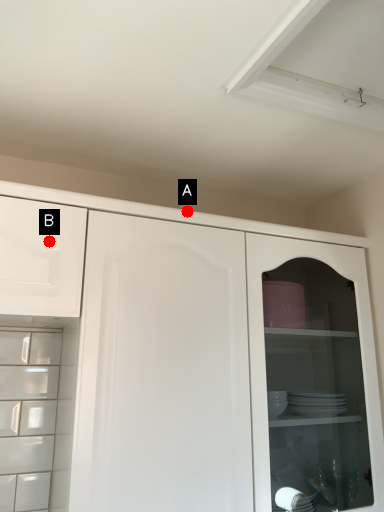
Question: Two points are circled on the image, labeled by A and B beside each circle. Which point appears closest to the camera in this image?

Choices:
 (A) A is closer
 (B) B is closer

Answer: (B)